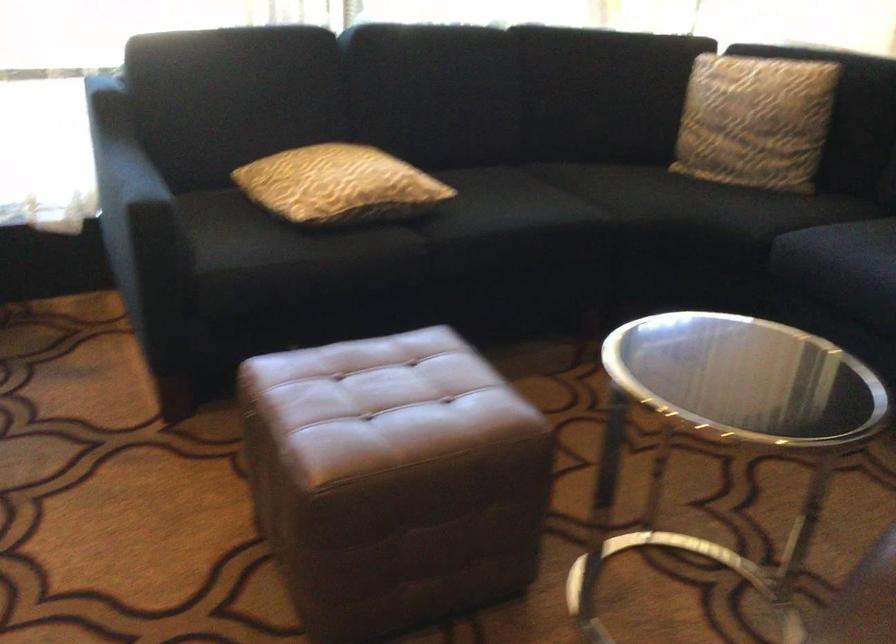
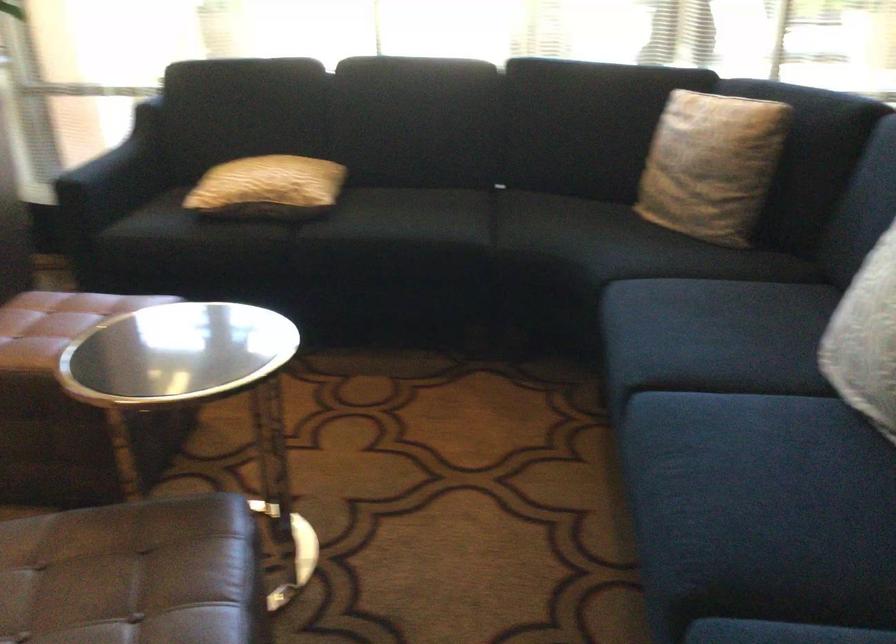
In the second image, find the point that corresponds to pixel 118 162 in the first image.

(104, 147)